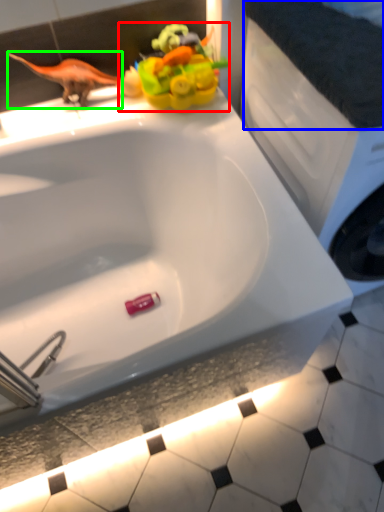
Question: Considering the real-world distances, which object is farthest from toy (highlighted by a red box)? counter top (highlighted by a blue box) or animal (highlighted by a green box)?

Choices:
 (A) counter top
 (B) animal

Answer: (A)